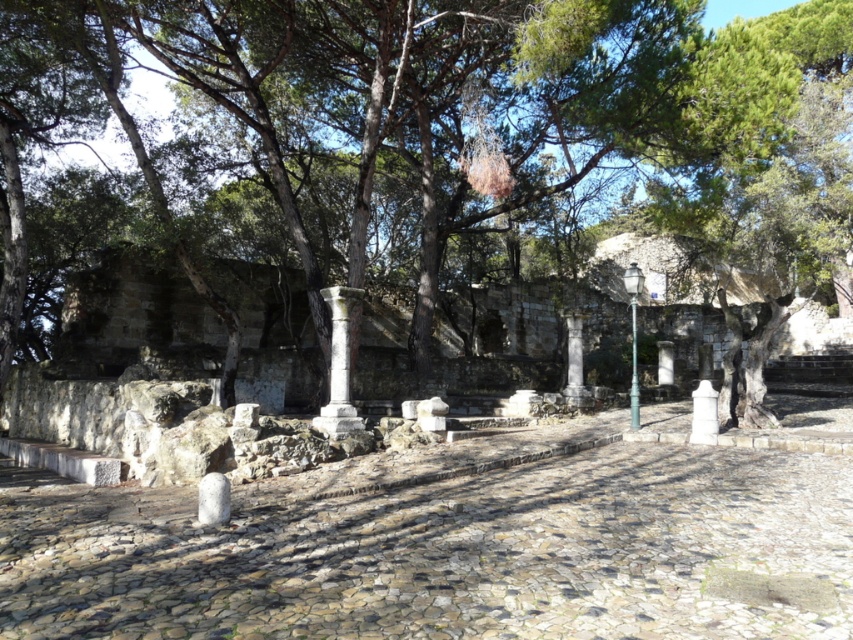
In the scene shown: Who is more distant from viewer, (x=335, y=413) or (x=714, y=428)?

The point (x=714, y=428) is behind.

Describe the element at coordinates (339, 365) in the screenshot. The width and height of the screenshot is (853, 640). I see `white stone column at center` at that location.

Who is more distant from viewer, (329, 378) or (699, 392)?

Point (329, 378)

You are a GUI agent. You are given a task and a screenshot of the screen. Output one action in this format:
    pyautogui.click(x=<x>, y=<y>)
    Task: Click on the white stone column at center
    
    Given the screenshot: What is the action you would take?
    pyautogui.click(x=339, y=365)

The width and height of the screenshot is (853, 640). I want to click on green leafy tree at center, so click(509, 116).

Based on the photo, which is more to the left, green leafy tree at center or white stone column at center?

white stone column at center

Between point (343, 157) and point (344, 355), which one is positioned in front?

Positioned in front is point (344, 355).

Find the location of `green leafy tree at center`. green leafy tree at center is located at coordinates (509, 116).

Does point (666, 218) come in front of point (581, 330)?

No, it is not.

Based on the photo, is green leafy tree at center smaller than smooth stone column at center?

No.

Does point (463, 45) come closer to viewer compared to point (564, 314)?

That is True.

Where is `green leafy tree at center`? green leafy tree at center is located at coordinates (509, 116).